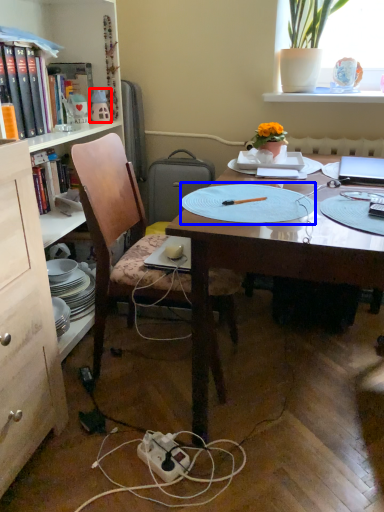
Question: Among these objects, which one is farthest to the camera, toy (highlighted by a red box) or paper plate (highlighted by a blue box)?

Choices:
 (A) toy
 (B) paper plate

Answer: (A)